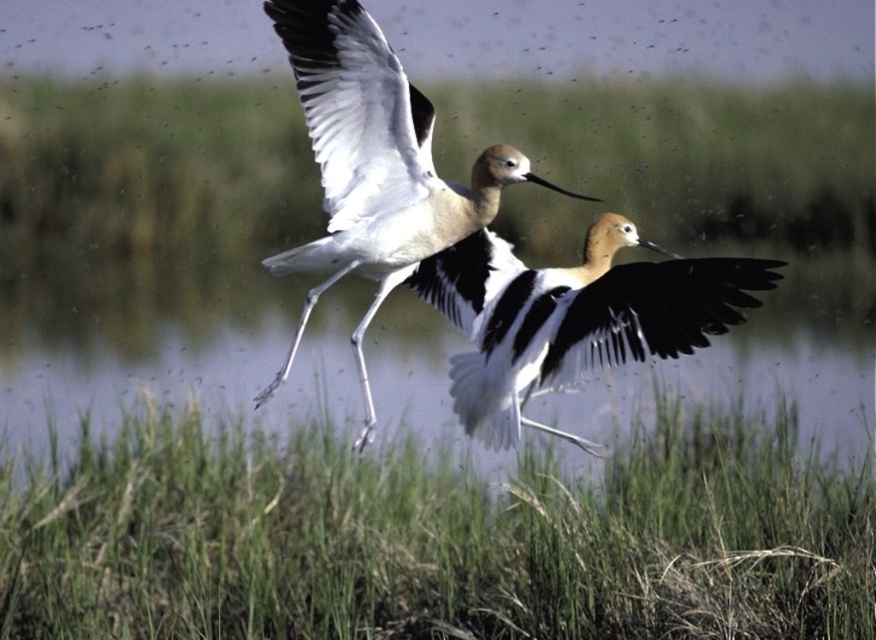
You are a birdwatcher observing two American Avocets flying over a grassy wetland. You notice the green grass at center and the white feathered bird at center. Which object is positioned to the left of the other?

The green grass at center is to the left of the white feathered bird at center.

You are a birdwatcher observing the scene. You notice the green grass at center and the black and white feathers at center. Which object is closer to you?

The green grass at center is closer to you because the black and white feathers at center are positioned behind it.

You are a wildlife photographer aiming to capture a clear photo of both the black and white feathers at center and the white feathered bird at center. Since you want both birds to appear equally large in the photo, which bird should you focus on and why?

The black and white feathers at center has a larger width than the white feathered bird at center. To make both birds appear equally large in the photo, you should focus on the white feathered bird at center and move closer to it, while keeping the black and white feathers at center at a distance. This way, the larger bird will appear smaller and the smaller bird will appear larger, balancing their sizes in the frame.